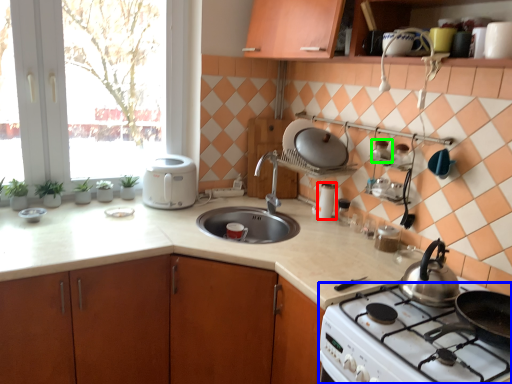
Question: Which object is the farthest from kitchen appliance (highlighted by a red box)? Choose among these: gas stove (highlighted by a blue box) or appliance (highlighted by a green box).

Choices:
 (A) gas stove
 (B) appliance

Answer: (A)